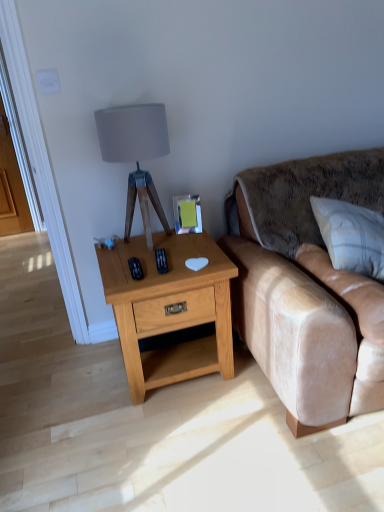
This screenshot has height=512, width=384. I want to click on free space to the left of light oak wood nightstand at center, so click(76, 386).